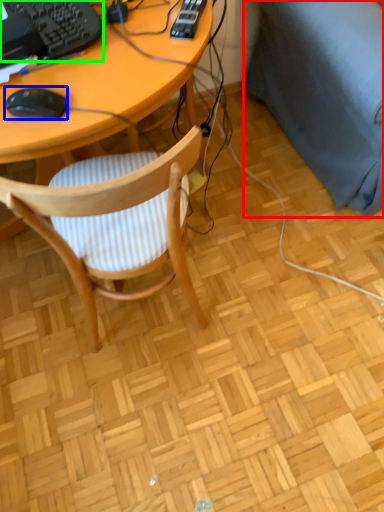
Question: Considering the real-world distances, which object is farthest from couch (highlighted by a red box)? mouse (highlighted by a blue box) or computer keyboard (highlighted by a green box)?

Choices:
 (A) mouse
 (B) computer keyboard

Answer: (A)